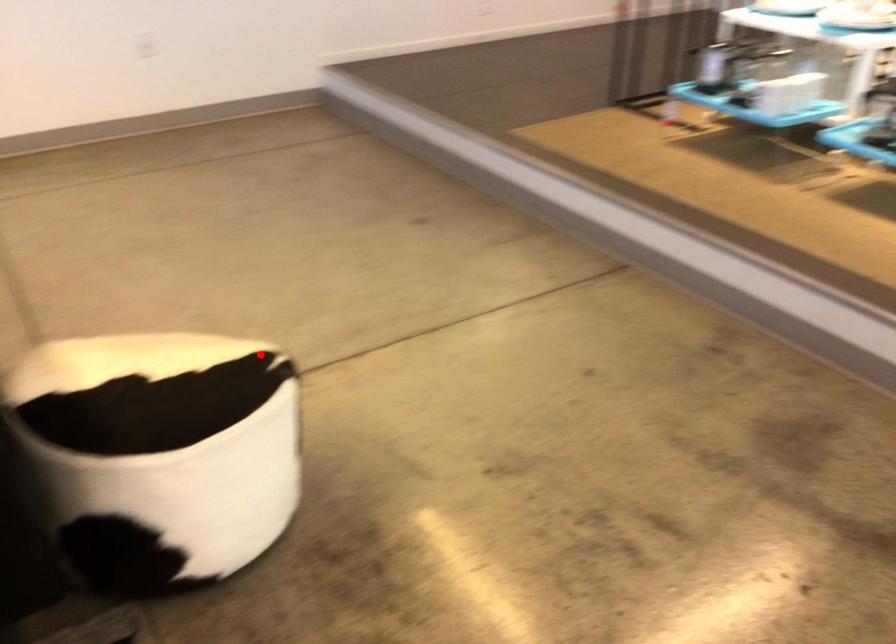
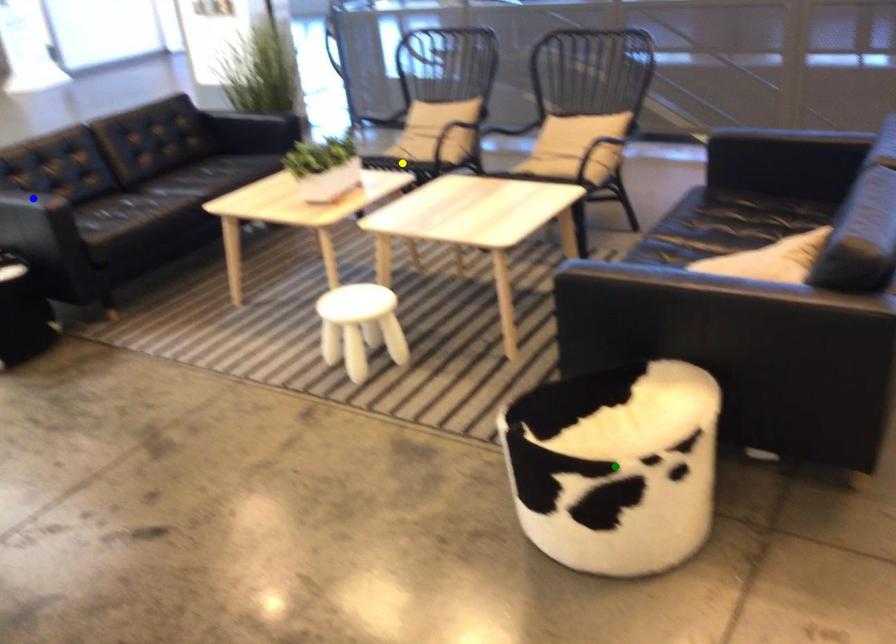
Question: I am providing you with two images of the same scene from different viewpoints. A red point is marked on the first image. You are given multiple points on the second image. Which point in image 2 represents the same 3d spot as the red point in image 1?

Choices:
 (A) green point
 (B) yellow point
 (C) blue point

Answer: (A)